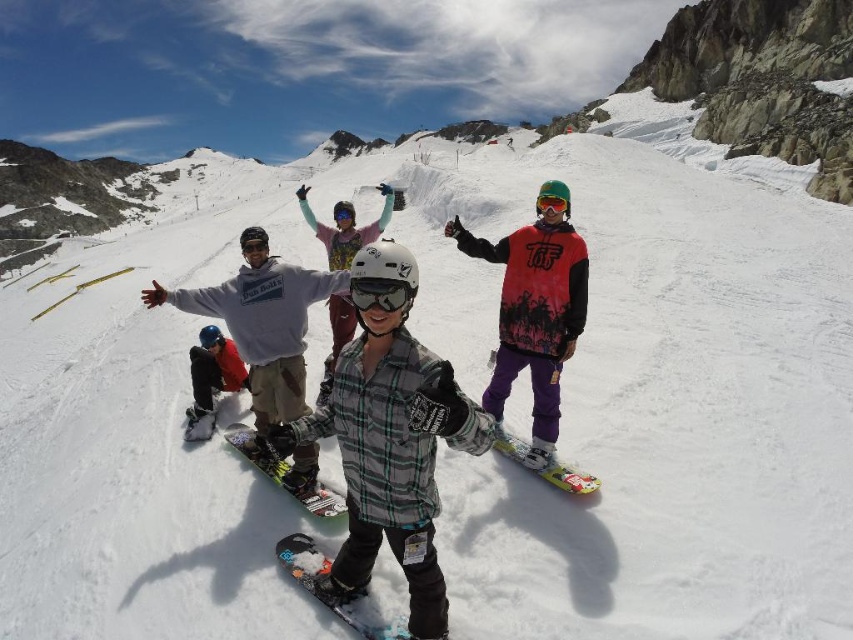
You are a photographer standing at the camera position. You want to take a photo focusing on the two points in the scene labeled as point (x=500, y=316) and point (x=556, y=211). Which point will appear larger in your photo?

Point (x=500, y=316) is closer to the camera than point (x=556, y=211), so it will appear larger in the photo.

You are a photographer standing at the camera position. You want to take a closeup photo of the multicolored plastic snowboard at center. The camera can focus on objects within 30 meters. Will you be able to take the closeup photo without moving closer?

The multicolored plastic snowboard at center is 32.37 meters from the camera, which is beyond the 30 meters focus range. Therefore, you cannot take the closeup photo without moving closer.

You are standing at the bottom of the mountain and see the point marked at coordinates (326,573). What object is located at that point?

The point at (326,573) marks a multicolored plastic snowboard at center.